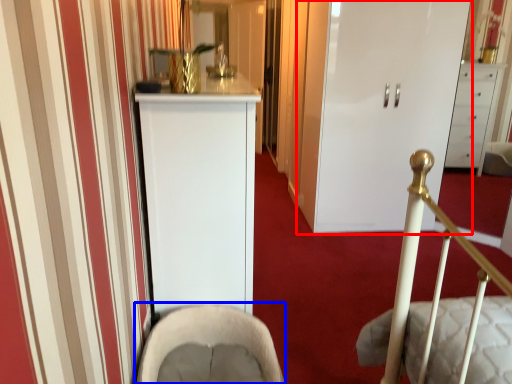
Question: Which of the following is the farthest to the observer, door (highlighted by a red box) or rocking chair (highlighted by a blue box)?

Choices:
 (A) door
 (B) rocking chair

Answer: (A)